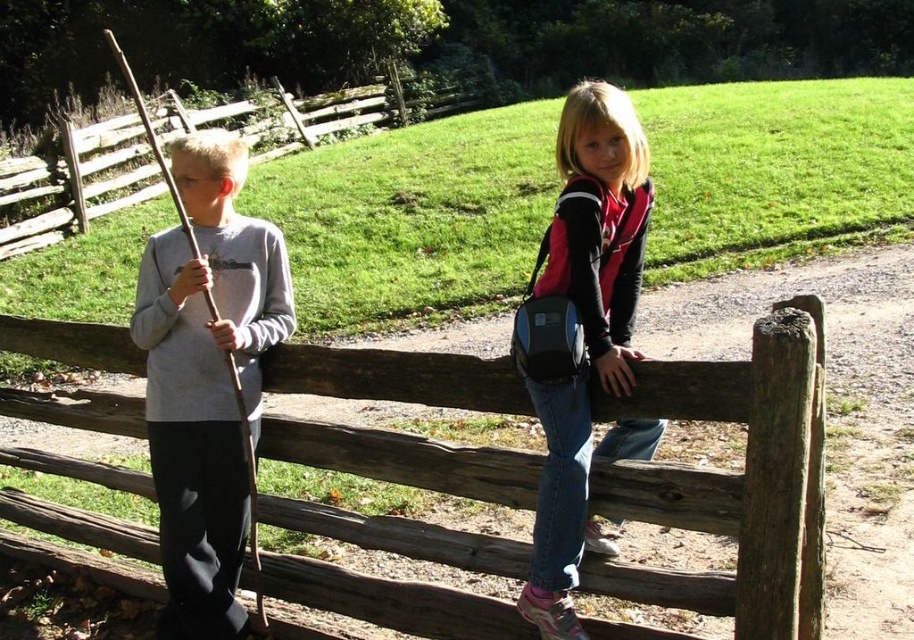
Question: Observing the image, what is the correct spatial positioning of gray matte stick at left in reference to denim jeans at center?

Choices:
 (A) left
 (B) right

Answer: (A)

Question: Which of the following is the farthest from the observer?

Choices:
 (A) (561, 637)
 (B) (433, 403)
 (C) (60, 182)
 (D) (227, 298)

Answer: (C)

Question: Is weathered wood fence at center to the left of gray matte stick at left from the viewer's perspective?

Choices:
 (A) yes
 (B) no

Answer: (B)

Question: Which point appears farthest from the camera in this image?

Choices:
 (A) (645, 390)
 (B) (556, 336)
 (C) (146, 163)

Answer: (C)

Question: Is weathered wood fence at center bigger than gray matte stick at left?

Choices:
 (A) no
 (B) yes

Answer: (B)

Question: Which point is farther to the camera?

Choices:
 (A) denim jeans at center
 (B) gray matte stick at left
 (C) brown wooden fence at left

Answer: (C)